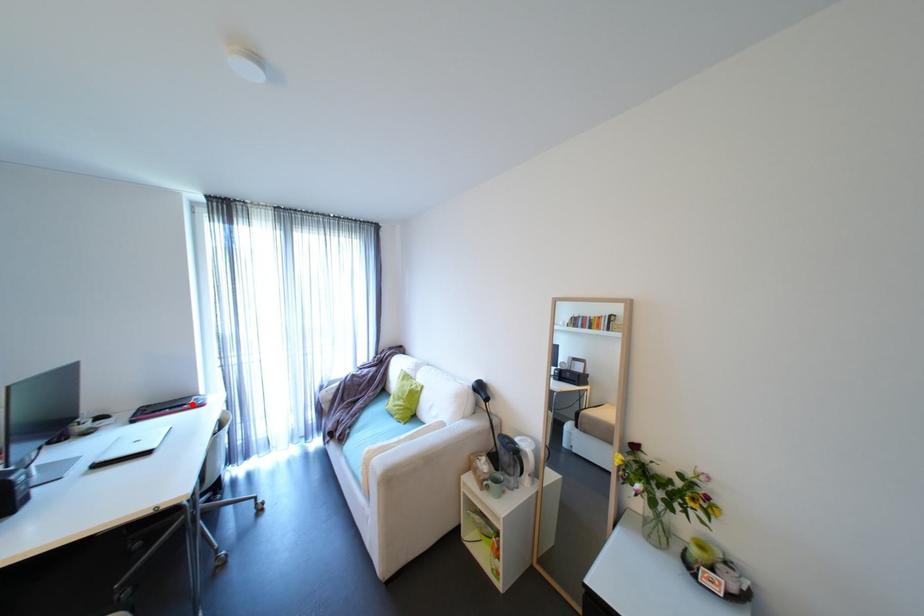
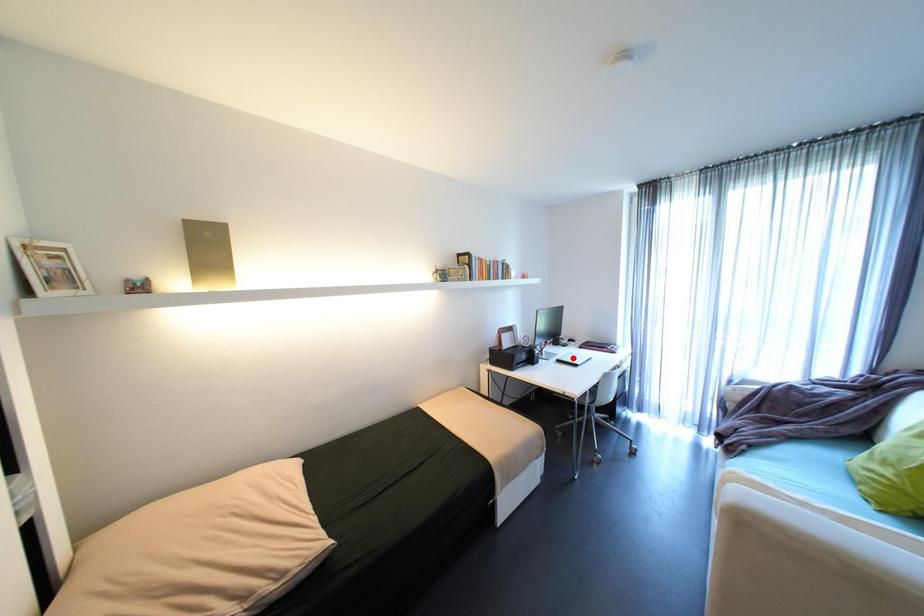
I am providing you with two images of the same scene from different viewpoints. A red point is marked on the first image and another point is marked on the second image. Does the point marked in image1 correspond to the same location as the one in image2?

No